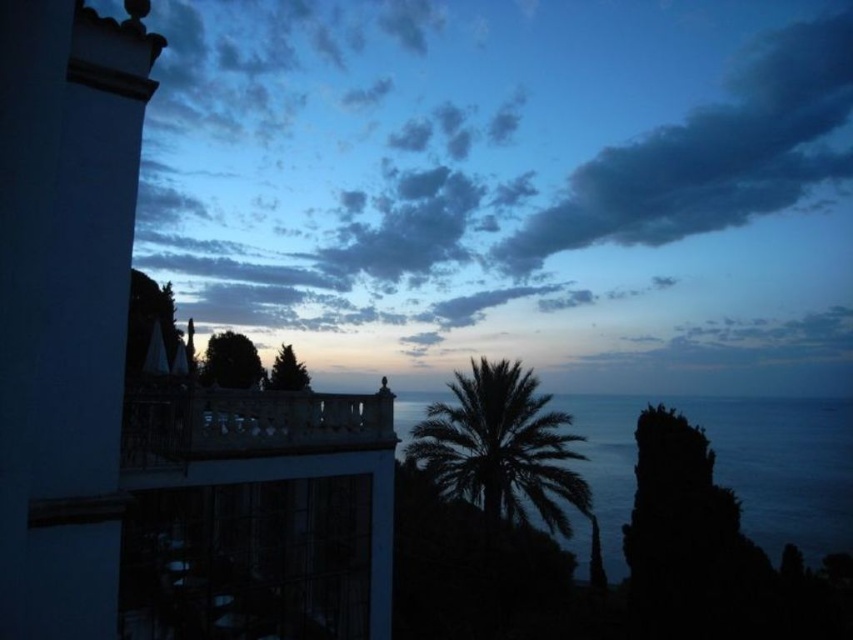
Is dark blue cloud at upper center to the left of dark gray cloud at upper right from the viewer's perspective?

Correct, you'll find dark blue cloud at upper center to the left of dark gray cloud at upper right.

Is dark blue cloud at upper center bigger than dark gray cloud at upper right?

Yes, dark blue cloud at upper center is bigger than dark gray cloud at upper right.

Is point (437, 292) behind point (820, 77)?

No, (437, 292) is closer to viewer.

This screenshot has width=853, height=640. What are the coordinates of `dark blue cloud at upper center` in the screenshot? It's located at (498, 168).

Between green leafy palm tree at center and white stone balcony at center, which one has less height?

Standing shorter between the two is white stone balcony at center.

Between point (467, 496) and point (171, 452), which one is positioned in front?

Point (171, 452)

Locate an element on the screen. The image size is (853, 640). green leafy palm tree at center is located at coordinates (502, 445).

Who is more distant from viewer, (310, 452) or (585, 189)?

Point (585, 189)

Does white stone balcony at upper left have a greater width compared to dark gray cloud at upper right?

In fact, white stone balcony at upper left might be narrower than dark gray cloud at upper right.

This screenshot has height=640, width=853. What are the coordinates of `white stone balcony at upper left` in the screenshot? It's located at (260, 508).